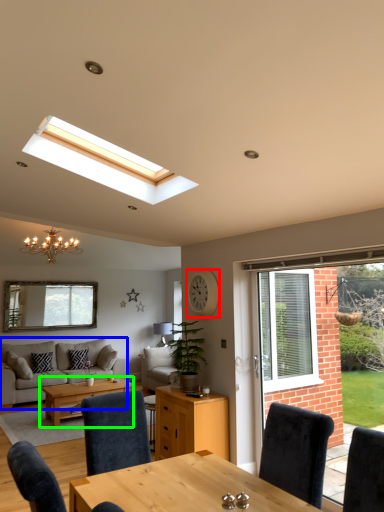
Question: Considering the real-world distances, which object is closest to clock (highlighted by a red box)? studio couch (highlighted by a blue box) or coffee table (highlighted by a green box).

Choices:
 (A) studio couch
 (B) coffee table

Answer: (B)